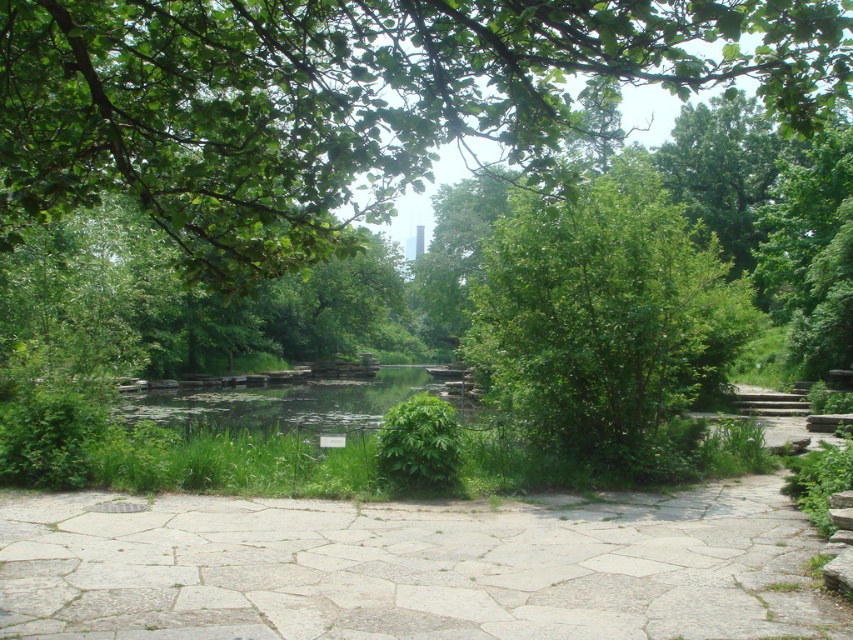
Which is in front, point (585, 44) or point (764, 596)?

Point (585, 44) is more forward.

Does green leafy tree at upper center have a lesser height compared to white stone path at center?

No.

The image size is (853, 640). In order to click on green leafy tree at upper center in this screenshot , I will do `click(347, 100)`.

The width and height of the screenshot is (853, 640). I want to click on green leafy tree at upper center, so click(x=347, y=100).

Is white stone path at center behind green leafy bush at center?

Yes, it is behind green leafy bush at center.

Is white stone path at center taller than green leafy bush at center?

No, white stone path at center is not taller than green leafy bush at center.

What do you see at coordinates (415, 566) in the screenshot?
I see `white stone path at center` at bounding box center [415, 566].

The width and height of the screenshot is (853, 640). Find the location of `white stone path at center`. white stone path at center is located at coordinates (415, 566).

Is green leafy tree at upper center below green leafy bush at center?

No.

Is green leafy tree at upper center positioned in front of green leafy bush at center?

Yes, green leafy tree at upper center is closer to the viewer.

What do you see at coordinates (347, 100) in the screenshot? The image size is (853, 640). I see `green leafy tree at upper center` at bounding box center [347, 100].

Identify the location of green leafy tree at upper center. (347, 100).